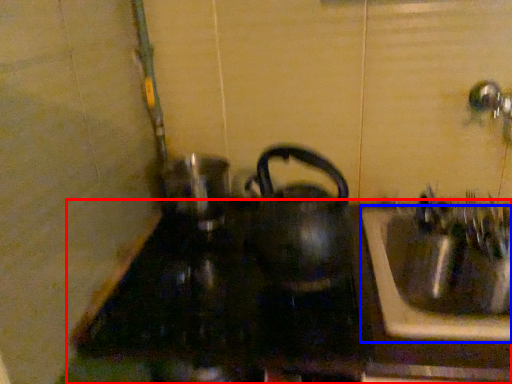
Question: Among these objects, which one is nearest to the camera, counter top (highlighted by a red box) or sink (highlighted by a blue box)?

Choices:
 (A) counter top
 (B) sink

Answer: (A)